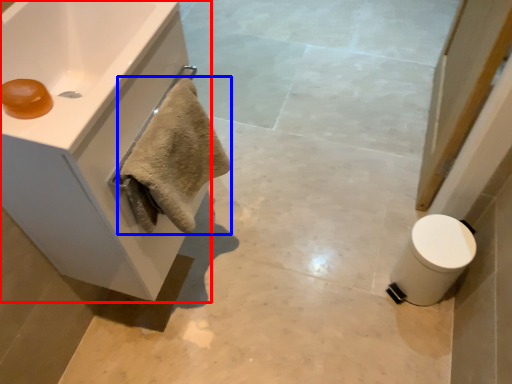
Question: Among these objects, which one is farthest to the camera, bathroom cabinet (highlighted by a red box) or bath towel (highlighted by a blue box)?

Choices:
 (A) bathroom cabinet
 (B) bath towel

Answer: (B)